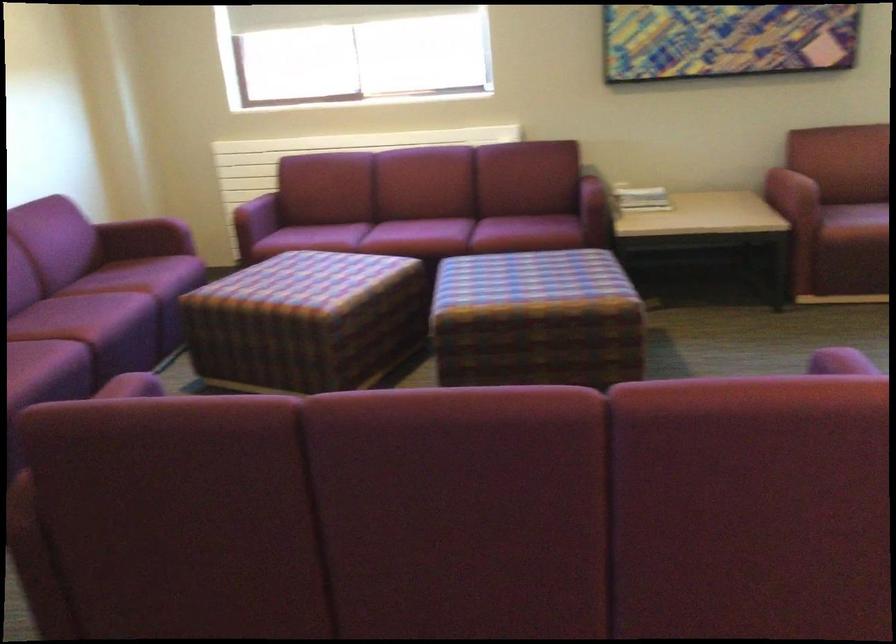
Find where to resting arm the red chair armrest. Please return your answer as a coordinate pair (x, y).

(791, 194)